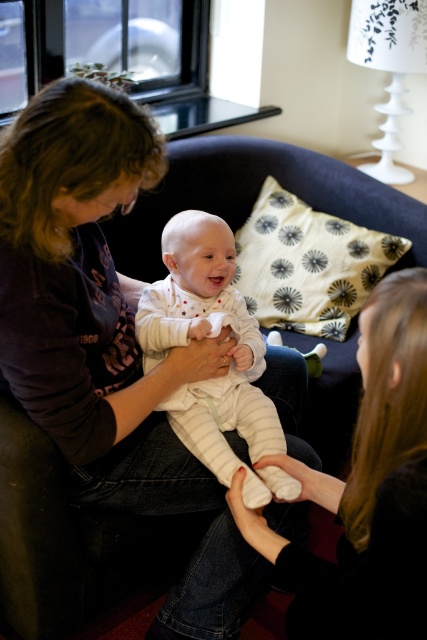
Does matte black shirt at center have a greater height compared to white striped onesie at center?

Indeed, matte black shirt at center has a greater height compared to white striped onesie at center.

Consider the image. Who is taller, matte black shirt at center or white striped onesie at center?

Standing taller between the two is matte black shirt at center.

Is point (26, 289) in front of point (257, 449)?

Yes, point (26, 289) is closer to viewer.

Identify the location of matte black shirt at center. (105, 339).

Does matte black shirt at center appear on the left side of smooth black hair at upper right?

Yes, matte black shirt at center is to the left of smooth black hair at upper right.

Does matte black shirt at center appear on the right side of smooth black hair at upper right?

Incorrect, matte black shirt at center is not on the right side of smooth black hair at upper right.

Find the location of a particular element. matte black shirt at center is located at coordinates (105, 339).

This screenshot has height=640, width=427. In order to click on matte black shirt at center in this screenshot , I will do `click(105, 339)`.

Who is shorter, smooth black hair at upper right or white striped onesie at center?

white striped onesie at center

From the picture: Is smooth black hair at upper right to the left of white striped onesie at center from the viewer's perspective?

Incorrect, smooth black hair at upper right is not on the left side of white striped onesie at center.

What do you see at coordinates (366, 490) in the screenshot? The width and height of the screenshot is (427, 640). I see `smooth black hair at upper right` at bounding box center [366, 490].

Image resolution: width=427 pixels, height=640 pixels. I want to click on smooth black hair at upper right, so click(366, 490).